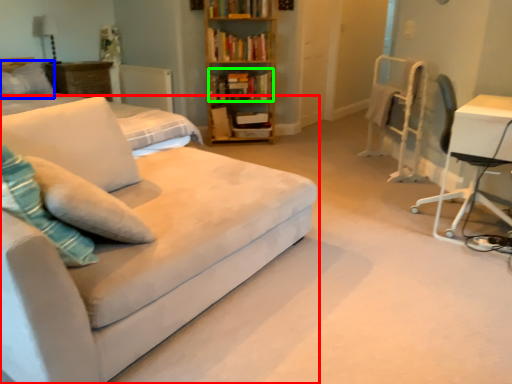
Question: Which object is positioned closest to studio couch (highlighted by a red box)? Select from pillow (highlighted by a blue box) and book (highlighted by a green box).

Choices:
 (A) pillow
 (B) book

Answer: (B)